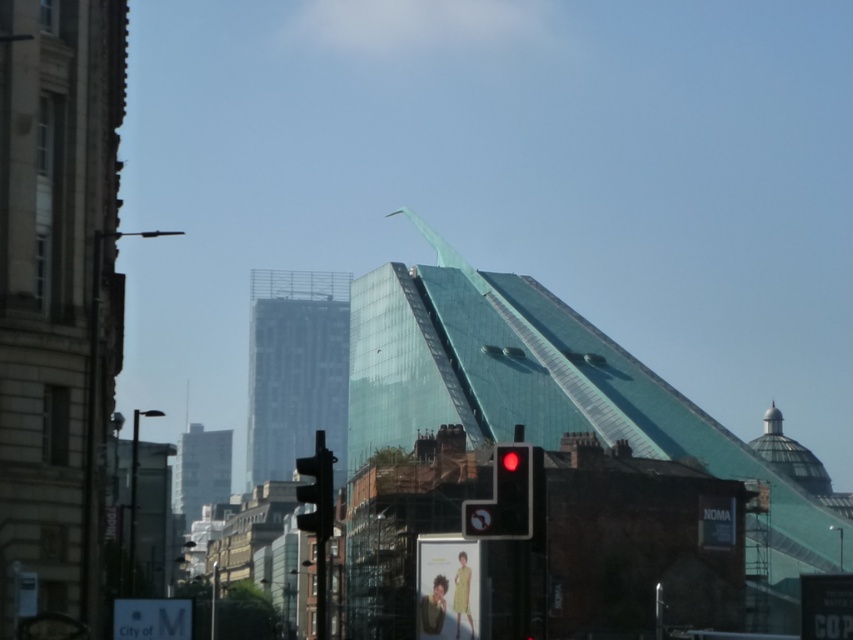
You are a city planner assessing the urban layout. You need to determine which traffic light is taller between the matte black traffic light at center and the red glass traffic light at center. Based on the scene, which one is taller?

The matte black traffic light at center is taller than the red glass traffic light at center according to the description.